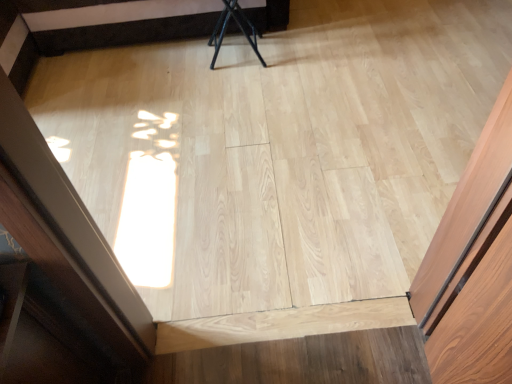
The image size is (512, 384). I want to click on free space to the back side of black metal tripod at upper center, so click(238, 39).